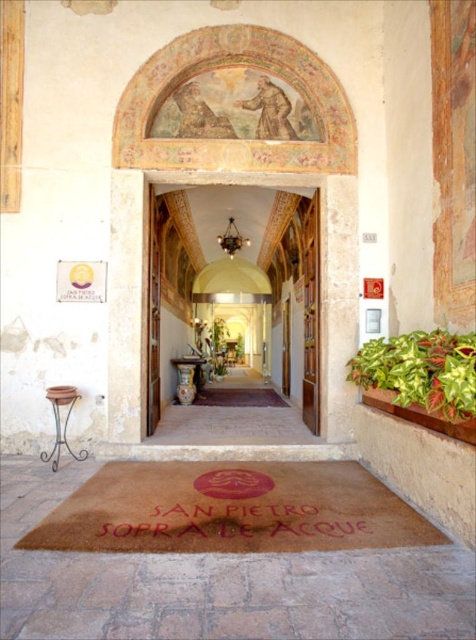
You are a delivery person with a large package that is 1 meter wide. You need to place it on the floor near the entrance. The package is too heavy to lift, so you can only slide it forward from your current position. There is a brown coir mat at center and a matte gold door at center in the way. Can the package fit between them without needing to lift it?

The brown coir mat at center might be wider than matte gold door at center, so the package might not fit through the space between them. You should check the exact width before sliding it forward.

You are standing at the entrance of the building and want to step onto the brown coir mat at center and the green variegated leaf at right. Which object will you encounter first as you approach the entrance?

The brown coir mat at center is closer to you than the green variegated leaf at right, so you will encounter the brown coir mat at center first as you approach the entrance.

You are standing at the entrance of the building and want to place a small potted plant between the brown coir mat at center and the green variegated leaf at right. Which object should the plant be closer to based on their heights?

The brown coir mat at center is shorter than the green variegated leaf at right, so the plant should be placed closer to the brown coir mat at center to maintain visual balance between the two objects.